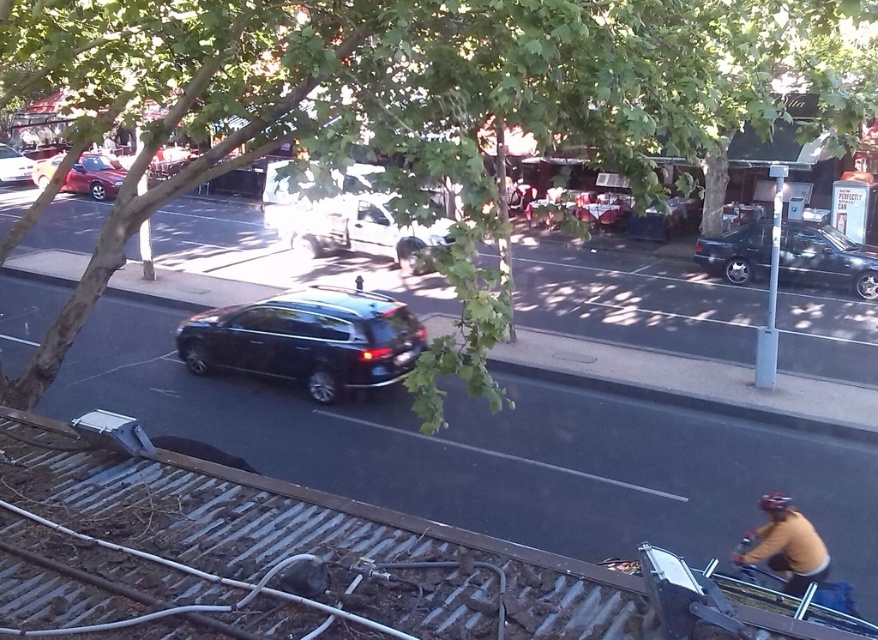
Which is behind, point (717, 97) or point (839, 241)?

Point (839, 241)

How distant is green leafy tree at upper center from shiny black sedan at right?

green leafy tree at upper center and shiny black sedan at right are 10.13 meters apart.

The image size is (878, 640). In order to click on green leafy tree at upper center in this screenshot , I will do `click(416, 108)`.

Is brown leather jacket at lower right closer to the viewer compared to shiny red sedan at left?

Yes.

Does point (786, 557) come behind point (44, 188)?

No, (786, 557) is in front of (44, 188).

The height and width of the screenshot is (640, 878). What do you see at coordinates (787, 545) in the screenshot?
I see `brown leather jacket at lower right` at bounding box center [787, 545].

You are a GUI agent. You are given a task and a screenshot of the screen. Output one action in this format:
    pyautogui.click(x=<x>, y=<y>)
    Task: Click on the brown leather jacket at lower right
    This screenshot has width=878, height=640.
    Given the screenshot: What is the action you would take?
    pyautogui.click(x=787, y=545)

Which is behind, point (347, 566) or point (439, 234)?

Point (439, 234)

Can you confirm if metallic gray train track at lower left is positioned above white matte van at center?

Incorrect, metallic gray train track at lower left is not positioned above white matte van at center.

Who is more distant from viewer, (x=436, y=550) or (x=322, y=218)?

Point (x=322, y=218)

This screenshot has width=878, height=640. Find the location of `metallic gray train track at lower left`. metallic gray train track at lower left is located at coordinates (318, 561).